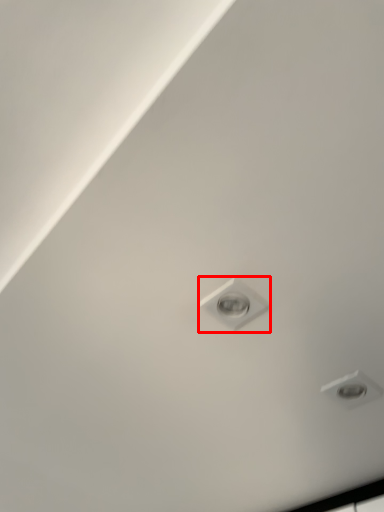
Question: From the image's perspective, where is light bulb (annotated by the red box) located relative to droplight?

Choices:
 (A) above
 (B) below

Answer: (A)